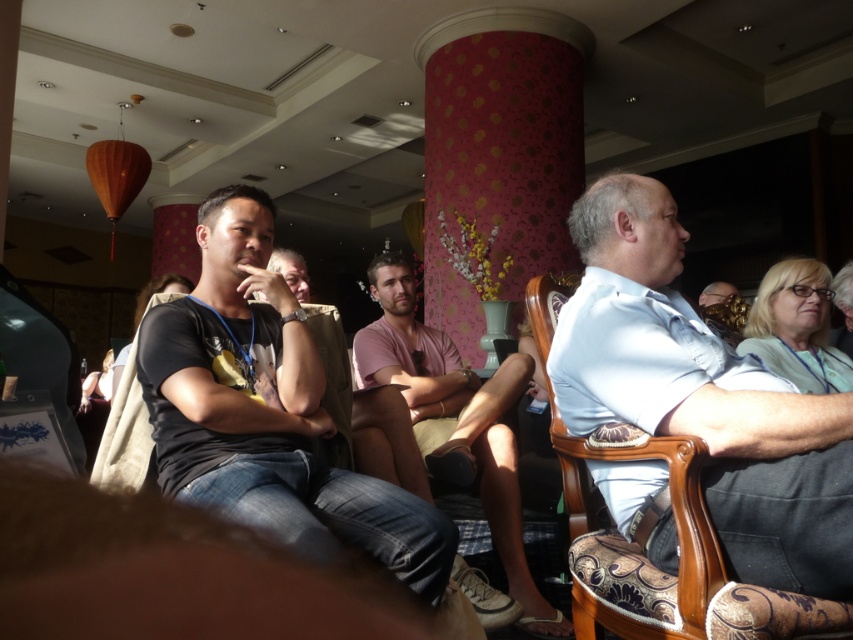
Measure the distance between point (643,397) and camera.

Point (643,397) and camera are 1.18 meters apart.

Which is behind, point (740, 420) or point (851, 323)?

Point (851, 323)

Locate an element on the screen. light blue denim shirt at center is located at coordinates (701, 396).

Which is below, black cotton t-shirt at center or denim jeans at lower left?

Positioned lower is black cotton t-shirt at center.

Does point (465, 614) come behind point (144, 605)?

That is True.

Is point (234, 465) closer to viewer compared to point (152, 563)?

No, (234, 465) is behind (152, 563).

Identify the location of black cotton t-shirt at center. (273, 417).

Who is more forward, [848,296] or [273,256]?

Point [273,256]

Is light blue shirt at center in front of matte black shirt at center?

No, it is behind matte black shirt at center.

Between point (850, 348) and point (302, 294), which one is positioned in front?

Positioned in front is point (302, 294).

What are the coordinates of `light blue shirt at center` in the screenshot? It's located at (843, 308).